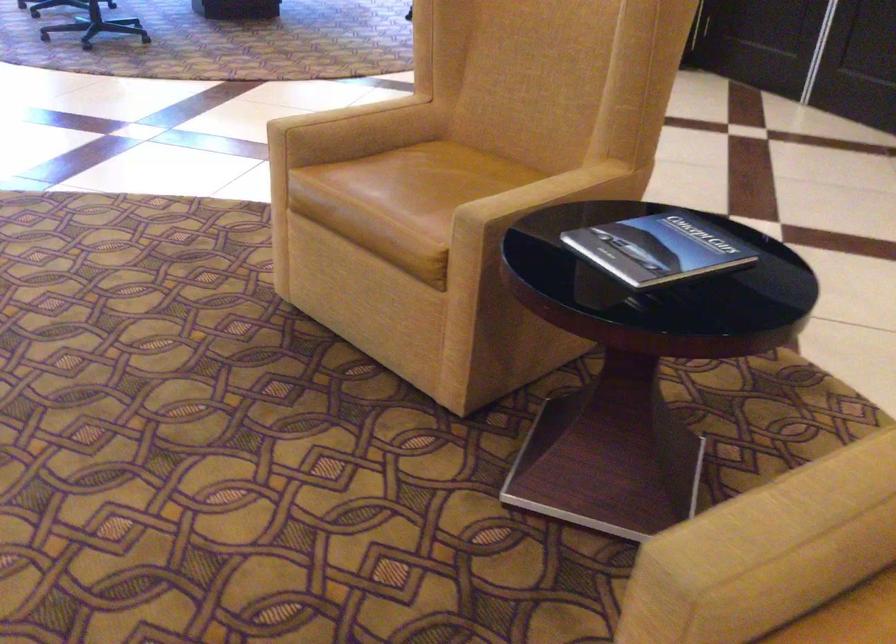
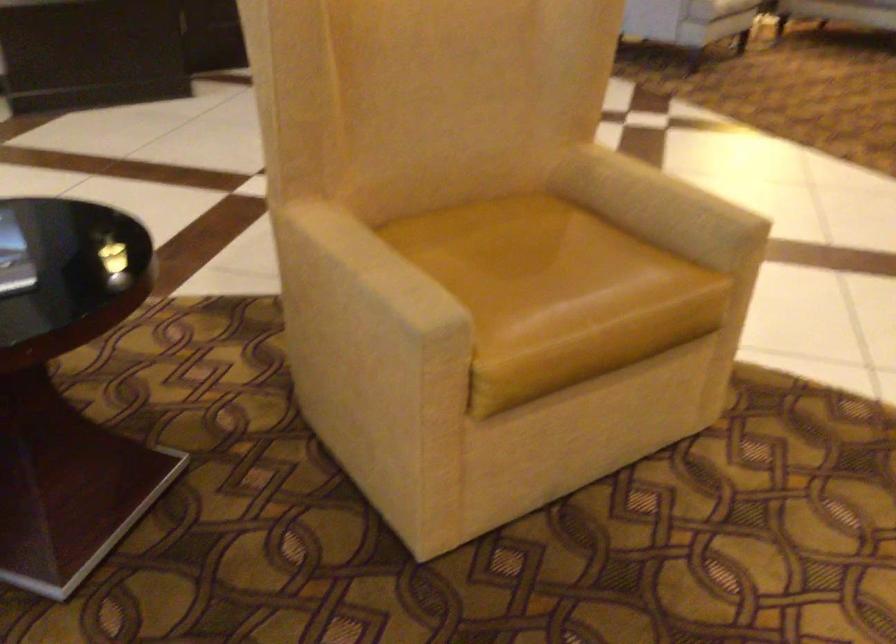
Locate, in the second image, the point that corresponds to [798,498] in the first image.

(375, 266)